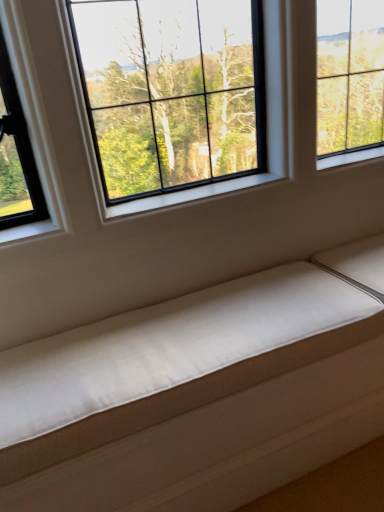
Measure the distance between satin beige studio couch at lower center and camera.

33.54 inches.

At what (x,y) coordinates should I click in order to perform the action: click on satin beige studio couch at lower center. Please return your answer as a coordinate pair (x, y). The width and height of the screenshot is (384, 512). Looking at the image, I should click on 199,392.

Image resolution: width=384 pixels, height=512 pixels. What do you see at coordinates (199, 392) in the screenshot?
I see `satin beige studio couch at lower center` at bounding box center [199, 392].

What are the coordinates of `satin beige studio couch at lower center` in the screenshot? It's located at tap(199, 392).